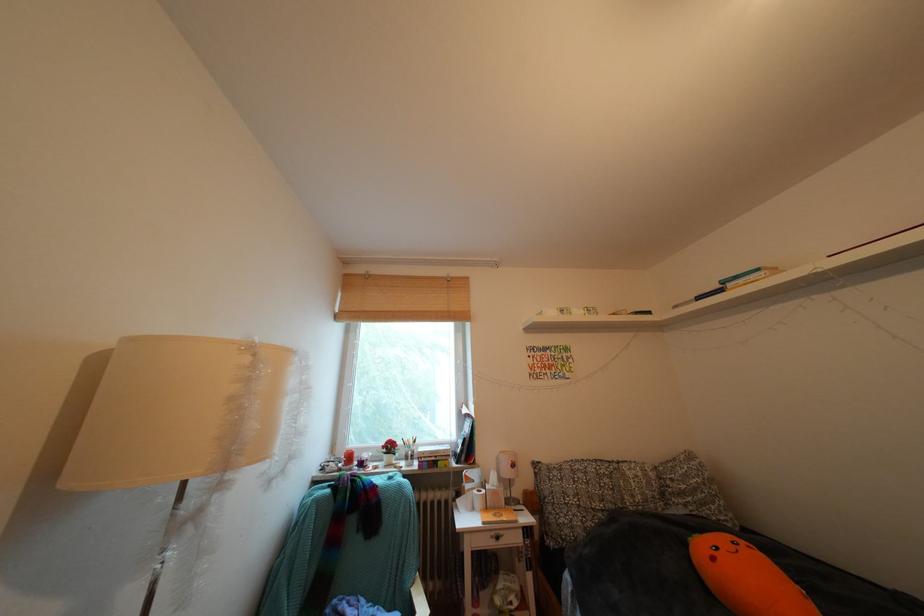
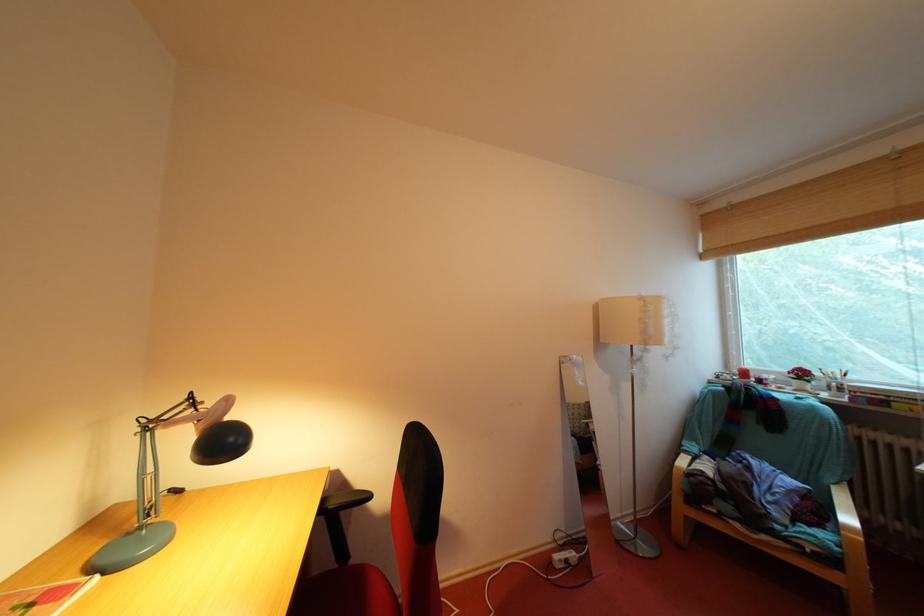
Where in the second image is the point corresponding to (409,448) from the first image?

(829, 379)